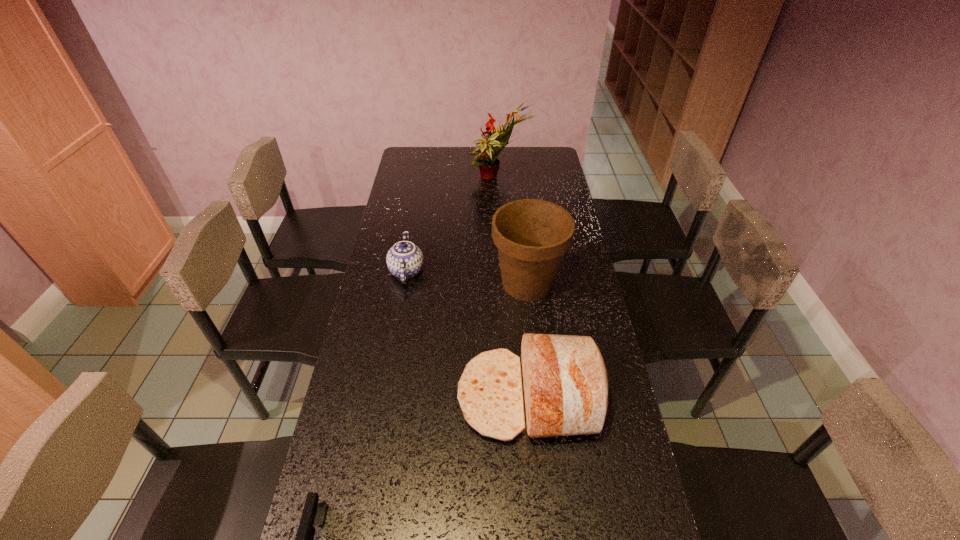
Where is `the tallest object`? Image resolution: width=960 pixels, height=540 pixels. the tallest object is located at coordinates point(486,159).

What are the coordinates of `bouquet` in the screenshot? It's located at (486, 159).

Where is `the second tallest object`? This screenshot has height=540, width=960. the second tallest object is located at coordinates (532, 235).

The width and height of the screenshot is (960, 540). In order to click on the third tallest object in this screenshot , I will do `click(565, 383)`.

Find the location of a particular element. the second nearest object is located at coordinates (565, 383).

Image resolution: width=960 pixels, height=540 pixels. I want to click on the second shortest object, so click(x=404, y=260).

Locate an element on the screen. the fourth object from right to left is located at coordinates (404, 260).

Identify the location of free point located 0.270m on the front-facing side of the bouquet. The height and width of the screenshot is (540, 960). (406, 180).

Locate an element on the screen. The height and width of the screenshot is (540, 960). vacant space located 0.240m on the front-facing side of the bouquet is located at coordinates (413, 180).

Where is `vacant position located on the front-facing side of the bouquet`? vacant position located on the front-facing side of the bouquet is located at coordinates (448, 180).